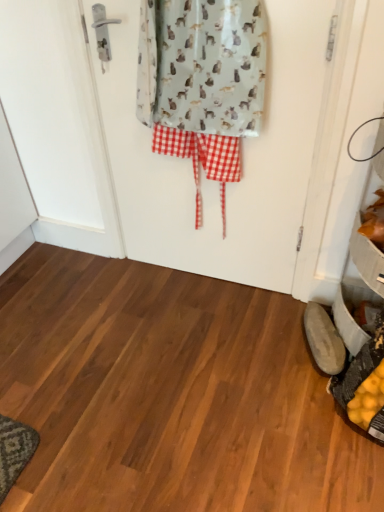
Question: Does light gray fabric with cat print at center have a greater width compared to orange matte leaves at lower right?

Choices:
 (A) no
 (B) yes

Answer: (A)

Question: Considering the relative sizes of light gray fabric with cat print at center and orange matte leaves at lower right in the image provided, is light gray fabric with cat print at center thinner than orange matte leaves at lower right?

Choices:
 (A) no
 (B) yes

Answer: (B)

Question: Is light gray fabric with cat print at center closer to the viewer compared to orange matte leaves at lower right?

Choices:
 (A) no
 (B) yes

Answer: (B)

Question: Is light gray fabric with cat print at center at the right side of orange matte leaves at lower right?

Choices:
 (A) yes
 (B) no

Answer: (B)

Question: Is light gray fabric with cat print at center positioned behind orange matte leaves at lower right?

Choices:
 (A) yes
 (B) no

Answer: (B)

Question: Is light gray fabric with cat print at center surrounding orange matte leaves at lower right?

Choices:
 (A) no
 (B) yes

Answer: (A)

Question: Does light gray fabric screen door at center turn towards light gray fabric with cat print at center?

Choices:
 (A) no
 (B) yes

Answer: (B)

Question: Can you confirm if light gray fabric screen door at center is taller than light gray fabric with cat print at center?

Choices:
 (A) yes
 (B) no

Answer: (A)

Question: Does light gray fabric screen door at center appear on the left side of light gray fabric with cat print at center?

Choices:
 (A) yes
 (B) no

Answer: (B)

Question: Is light gray fabric screen door at center shorter than light gray fabric with cat print at center?

Choices:
 (A) yes
 (B) no

Answer: (B)

Question: From the image's perspective, does light gray fabric screen door at center appear lower than light gray fabric with cat print at center?

Choices:
 (A) yes
 (B) no

Answer: (A)

Question: Can you confirm if light gray fabric screen door at center is smaller than light gray fabric with cat print at center?

Choices:
 (A) yes
 (B) no

Answer: (A)

Question: Can you confirm if light gray fabric screen door at center is positioned to the left of brown leather shoe at lower right?

Choices:
 (A) no
 (B) yes

Answer: (B)